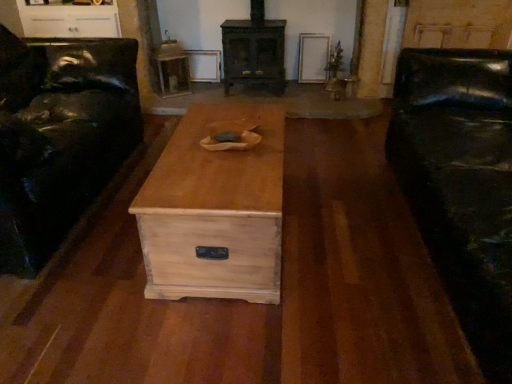
I want to click on free space in front of natural wood chest at center, so click(x=226, y=333).